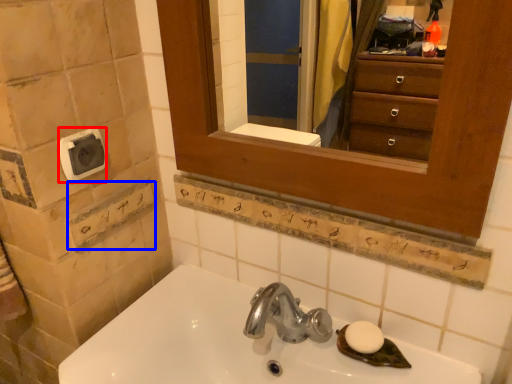
Question: Which point is closer to the camera, towel bar (highlighted by a red box) or square (highlighted by a blue box)?

Choices:
 (A) towel bar
 (B) square

Answer: (A)